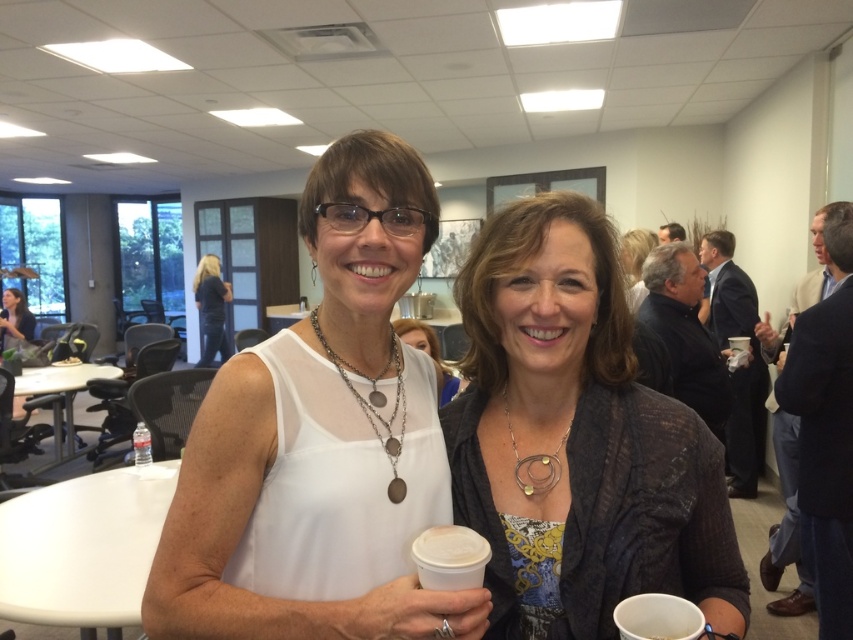
Is matte silver necklace at center further to camera compared to matte black hair at upper right?

No, it is in front of matte black hair at upper right.

From the picture: Between matte silver necklace at center and matte black hair at upper right, which one has more height?

matte black hair at upper right is taller.

Measure the distance between matte silver necklace at center and camera.

A distance of 1.04 meters exists between matte silver necklace at center and camera.

The image size is (853, 640). I want to click on matte silver necklace at center, so click(428, 355).

Can you confirm if matte black jacket at center is thinner than white matte cup at center?

Incorrect, matte black jacket at center's width is not less than white matte cup at center's.

Does matte black jacket at center have a smaller size compared to white matte cup at center?

No, matte black jacket at center is not smaller than white matte cup at center.

Between point (619, 461) and point (430, 532), which one is positioned in front?

Point (430, 532)

You are a GUI agent. You are given a task and a screenshot of the screen. Output one action in this format:
    pyautogui.click(x=<x>, y=<y>)
    Task: Click on the matte black jacket at center
    
    Given the screenshot: What is the action you would take?
    pyautogui.click(x=577, y=440)

Can you confirm if matte black jacket at center is wider than matte black laptop at left?

No, matte black jacket at center is not wider than matte black laptop at left.

Is matte black jacket at center bigger than matte black laptop at left?

No.

Locate an element on the screen. The image size is (853, 640). matte black jacket at center is located at coordinates (577, 440).

I want to click on matte black jacket at center, so click(x=577, y=440).